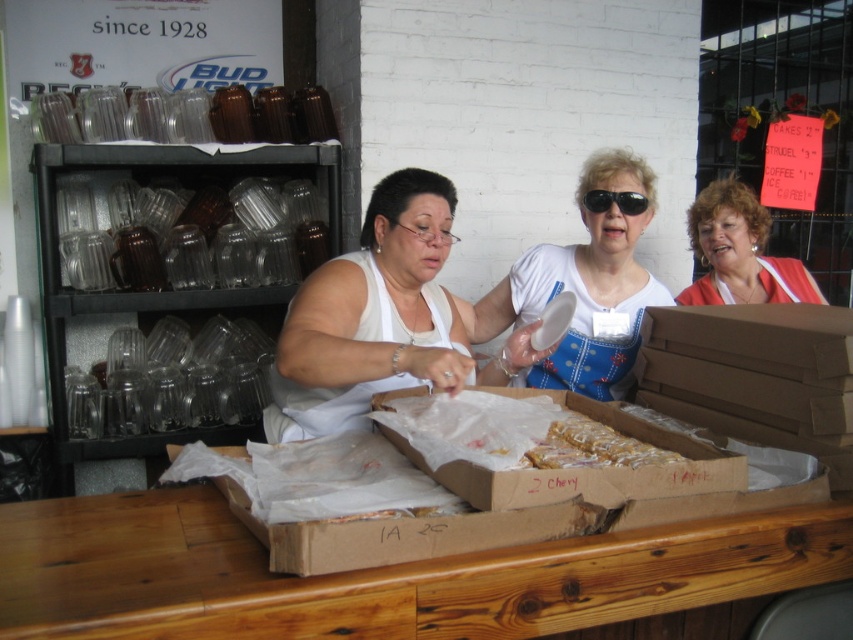
Who is taller, wooden table at center or brown cardboard box at lower center?

Standing taller between the two is wooden table at center.

Is wooden table at center closer to the viewer compared to brown cardboard box at lower center?

Yes, it is.

Identify the location of wooden table at center. This screenshot has width=853, height=640. (379, 573).

This screenshot has width=853, height=640. Identify the location of wooden table at center. (379, 573).

Based on the photo, between wooden table at center and golden brown pastry at center, which one has more height?

wooden table at center is taller.

What do you see at coordinates (379, 573) in the screenshot?
I see `wooden table at center` at bounding box center [379, 573].

The width and height of the screenshot is (853, 640). I want to click on wooden table at center, so click(x=379, y=573).

Is golden brown pastry at center above black plastic sunglasses at upper center?

Incorrect, golden brown pastry at center is not positioned above black plastic sunglasses at upper center.

Can you confirm if golden brown pastry at center is taller than black plastic sunglasses at upper center?

No.

You are a GUI agent. You are given a task and a screenshot of the screen. Output one action in this format:
    pyautogui.click(x=<x>, y=<y>)
    Task: Click on the golden brown pastry at center
    
    Given the screenshot: What is the action you would take?
    pyautogui.click(x=592, y=445)

The image size is (853, 640). I want to click on golden brown pastry at center, so click(x=592, y=445).